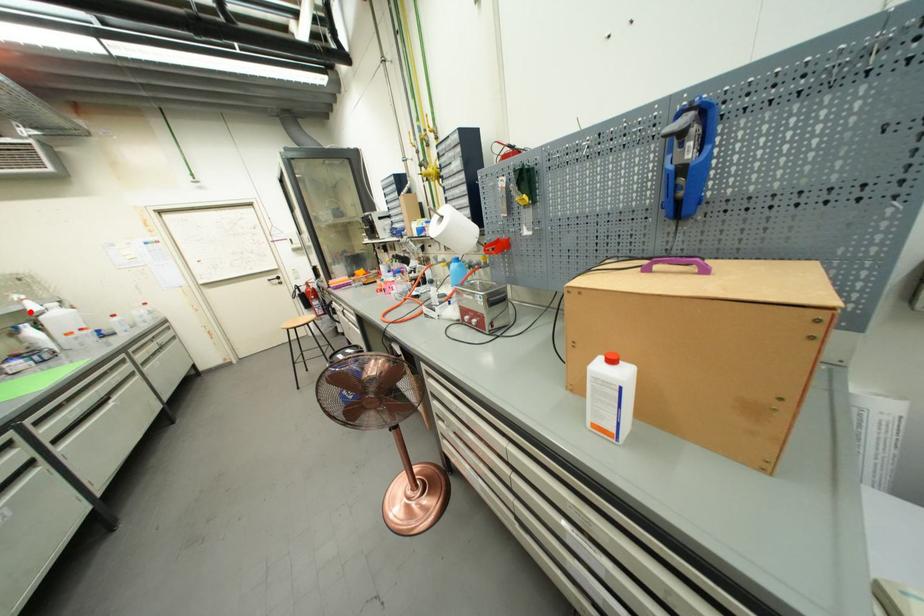
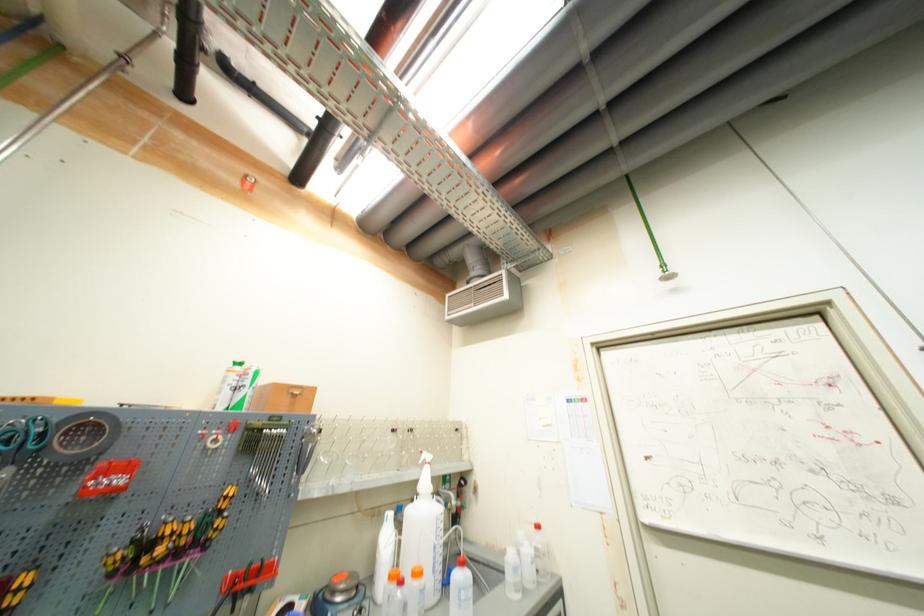
The point at the highlighted location is marked in the first image. Where is the corresponding point in the second image?

(421, 484)